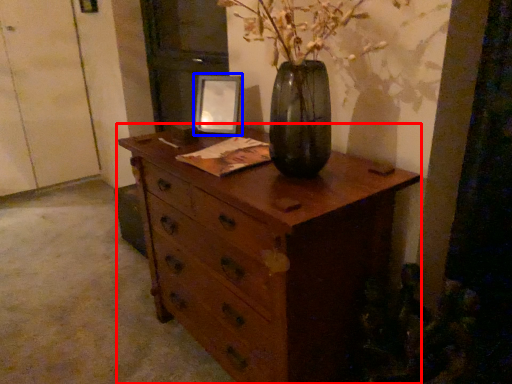
Question: Among these objects, which one is farthest to the camera, chest of drawers (highlighted by a red box) or picture frame (highlighted by a blue box)?

Choices:
 (A) chest of drawers
 (B) picture frame

Answer: (B)